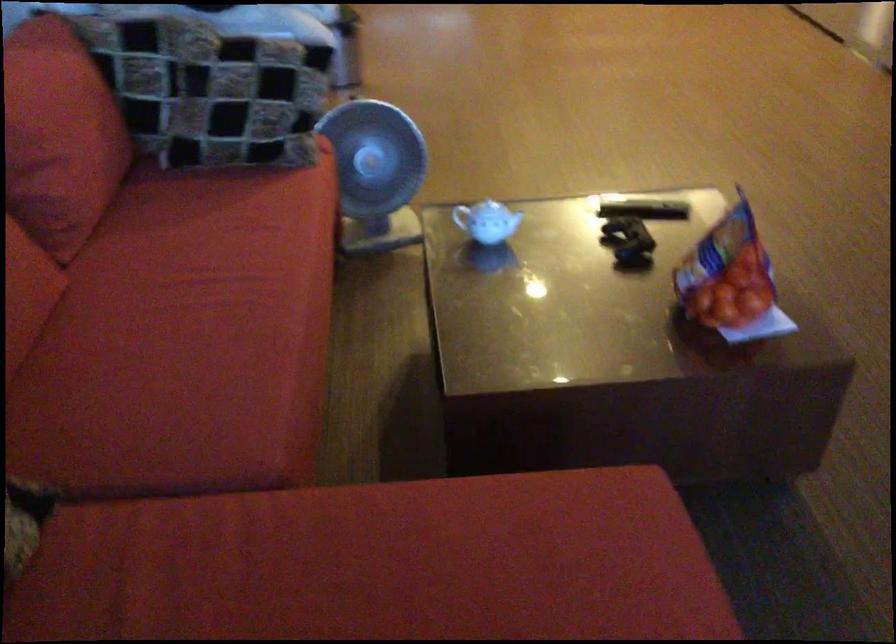
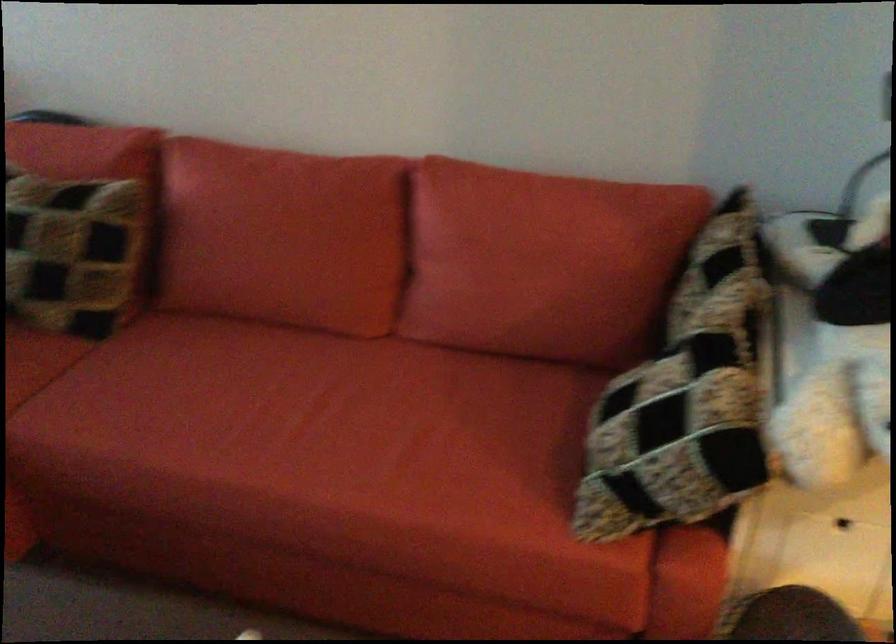
Where in the second image is the point corresponding to [85,125] from the first image?

(538, 270)